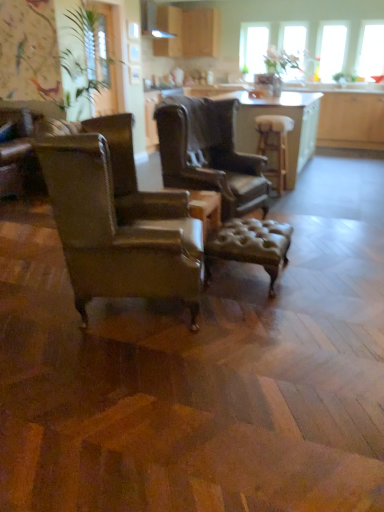
Describe the element at coordinates (293, 46) in the screenshot. I see `transparent glass vase at upper center, positioned as the third window screen in right-to-left order` at that location.

Looking at this image, how much space does transparent glass window at upper right, which is the second window screen in right-to-left order, occupy horizontally?

It is 14.28 centimeters.

The width and height of the screenshot is (384, 512). What are the coordinates of `leather armchair at left, the 2th chair viewed from the back` in the screenshot? It's located at (114, 231).

What is the approximate height of leather armchair at left, the 2th chair viewed from the back?

leather armchair at left, the 2th chair viewed from the back, is 1.06 meters tall.

Image resolution: width=384 pixels, height=512 pixels. What do you see at coordinates (251, 245) in the screenshot? I see `leather tufted stool at center, which is counted as the first stool, starting from the left` at bounding box center [251, 245].

The width and height of the screenshot is (384, 512). I want to click on transparent glass vase at upper center, which is counted as the second window screen, starting from the left, so click(293, 46).

From the image's perspective, is wooden table at center under wooden stool at center, arranged as the 2th stool when ordered from the bottom?

No, from the image's perspective, wooden table at center is not beneath wooden stool at center, arranged as the 2th stool when ordered from the bottom.

Which is more to the right, wooden table at center or wooden stool at center, which is the first stool from back to front?

Positioned to the right is wooden table at center.

Between wooden table at center and wooden stool at center, which ranks as the 1th stool in top-to-bottom order, which one has smaller size?

Smaller between the two is wooden stool at center, which ranks as the 1th stool in top-to-bottom order.

Measure the distance from wooden table at center to wooden stool at center, positioned as the 1th stool in right-to-left order.

wooden table at center is 6.11 inches away from wooden stool at center, positioned as the 1th stool in right-to-left order.

In terms of width, does transparent glass vase at upper center, positioned as the third window screen in right-to-left order, look wider or thinner when compared to transparent glass window at upper right, the first window screen positioned from the right?

Considering their sizes, transparent glass vase at upper center, positioned as the third window screen in right-to-left order, looks broader than transparent glass window at upper right, the first window screen positioned from the right.

From the image's perspective, relative to transparent glass window at upper right, the first window screen positioned from the right, is transparent glass vase at upper center, positioned as the third window screen in right-to-left order, above or below?

transparent glass vase at upper center, positioned as the third window screen in right-to-left order, is situated higher than transparent glass window at upper right, the first window screen positioned from the right, in the image.

Is point (291, 46) closer to camera compared to point (373, 67)?

That is False.

Which object is closer to the camera taking this photo, transparent glass vase at upper center, which is counted as the second window screen, starting from the left, or transparent glass window at upper right, the first window screen positioned from the right?

transparent glass window at upper right, the first window screen positioned from the right, is in front.

Considering the sizes of green leafy plant at upper left and wooden table at center in the image, is green leafy plant at upper left taller or shorter than wooden table at center?

green leafy plant at upper left is taller than wooden table at center.

Consider the image. From the image's perspective, is green leafy plant at upper left on wooden table at center?

Yes, from the image's perspective, green leafy plant at upper left is on top of wooden table at center.

From a real-world perspective, between green leafy plant at upper left and wooden table at center, who is vertically lower?

wooden table at center is physically lower.

Are green leafy plant at upper left and wooden table at center beside each other?

green leafy plant at upper left is not next to wooden table at center, and they're not touching.

Can you confirm if transparent glass window at upper right, which is the third window screen from left to right, is smaller than wooden cabinet at upper center?

Yes, transparent glass window at upper right, which is the third window screen from left to right, is smaller than wooden cabinet at upper center.

Is wooden cabinet at upper center at the back of transparent glass window at upper right, which is the second window screen in right-to-left order?

No, transparent glass window at upper right, which is the second window screen in right-to-left order, is not facing away from wooden cabinet at upper center.

Locate an element on the screen. The height and width of the screenshot is (512, 384). cabinetry above the transparent glass window at upper right, which is the second window screen in right-to-left order (from the image's perspective) is located at coordinates (188, 32).

From the picture: From a real-world perspective, is transparent glass window at upper right, which is the second window screen in right-to-left order, over wooden cabinet at upper center?

No, from a real-world perspective, transparent glass window at upper right, which is the second window screen in right-to-left order, is not over wooden cabinet at upper center

Is clear glass window at upper center, which is the fourth window screen from right to left, positioned with its back to wooden table at center?

That's not correct — clear glass window at upper center, which is the fourth window screen from right to left, is not looking away from wooden table at center.

This screenshot has height=512, width=384. There is a wooden table at center. What are the coordinates of `the 4th window screen above it (from the image's perspective)` in the screenshot? It's located at (253, 48).

How much distance is there between clear glass window at upper center, the 1th window screen when ordered from left to right, and wooden table at center?

A distance of 2.14 meters exists between clear glass window at upper center, the 1th window screen when ordered from left to right, and wooden table at center.

Which is behind, clear glass window at upper center, the 1th window screen when ordered from left to right, or wooden table at center?

Positioned behind is clear glass window at upper center, the 1th window screen when ordered from left to right.

Is leather tufted stool at center, the 2th stool positioned from the top, to the left of transparent glass window at upper right, positioned as the 4th window screen in left-to-right order, from the viewer's perspective?

Indeed, leather tufted stool at center, the 2th stool positioned from the top, is positioned on the left side of transparent glass window at upper right, positioned as the 4th window screen in left-to-right order.

Does leather tufted stool at center, positioned as the first stool in bottom-to-top order, have a greater height compared to transparent glass window at upper right, the first window screen positioned from the right?

No, leather tufted stool at center, positioned as the first stool in bottom-to-top order, is not taller than transparent glass window at upper right, the first window screen positioned from the right.

Does leather tufted stool at center, placed as the 2th stool when sorted from right to left, have a smaller size compared to transparent glass window at upper right, the first window screen positioned from the right?

Incorrect, leather tufted stool at center, placed as the 2th stool when sorted from right to left, is not smaller in size than transparent glass window at upper right, the first window screen positioned from the right.

Is leather tufted stool at center, which is counted as the first stool, starting from the left, beside transparent glass window at upper right, positioned as the 4th window screen in left-to-right order?

No.

Which object is closer to the camera, leather tufted stool at center, the 2th stool positioned from the top, or wooden stool at center, arranged as the 2th stool when viewed from the front?

leather tufted stool at center, the 2th stool positioned from the top, is in front.

The width and height of the screenshot is (384, 512). Identify the location of stool below the wooden stool at center, acting as the 2th stool starting from the left (from the image's perspective). (251, 245).

From a real-world perspective, relative to wooden stool at center, acting as the 2th stool starting from the left, is leather tufted stool at center, which ranks as the first stool in front-to-back order, vertically above or below?

From a real-world perspective, leather tufted stool at center, which ranks as the first stool in front-to-back order, is physically below wooden stool at center, acting as the 2th stool starting from the left.

Are leather tufted stool at center, acting as the 2th stool starting from the back, and wooden stool at center, which ranks as the 1th stool in top-to-bottom order, located far from each other?

Yes, leather tufted stool at center, acting as the 2th stool starting from the back, and wooden stool at center, which ranks as the 1th stool in top-to-bottom order, are located far from each other.

There is a wooden table at center. Where is `the 1st stool below it (from the image's perspective)`? This screenshot has height=512, width=384. the 1st stool below it (from the image's perspective) is located at coordinates (275, 145).

This screenshot has height=512, width=384. Identify the location of the 2nd window screen behind when counting from the transparent glass window at upper right, positioned as the 4th window screen in left-to-right order. (293, 46).

Based on their spatial positions, is transparent glass vase at upper center, which is counted as the second window screen, starting from the left, or wooden table at center further from wooden cabinet at upper center?

wooden table at center is positioned further to the anchor wooden cabinet at upper center.

From the image, which object appears to be nearer to transparent glass window at upper right, positioned as the 4th window screen in left-to-right order, clear glass window at upper center, which is the fourth window screen from right to left, or wooden cabinet at upper center?

clear glass window at upper center, which is the fourth window screen from right to left, lies closer to transparent glass window at upper right, positioned as the 4th window screen in left-to-right order, than the other object.

Estimate the real-world distances between objects in this image. Which object is closer to green leafy plant at upper left, transparent glass window at upper right, the first window screen positioned from the right, or wooden table at center?

wooden table at center is positioned closer to the anchor green leafy plant at upper left.

Which object lies further to the anchor point transparent glass window at upper right, which is the third window screen from left to right, green leafy plant at upper left or transparent glass vase at upper center, positioned as the third window screen in right-to-left order?

Among the two, green leafy plant at upper left is located further to transparent glass window at upper right, which is the third window screen from left to right.

From the image, which object appears to be nearer to clear glass window at upper center, the 1th window screen when ordered from left to right, leather armchair at left, acting as the first chair starting from the front, or wooden table at center?

wooden table at center is closer to clear glass window at upper center, the 1th window screen when ordered from left to right.

Which object lies further to the anchor point leather armchair at center, the 2th chair when ordered from front to back, transparent glass window at upper right, the first window screen positioned from the right, or wooden table at center?

transparent glass window at upper right, the first window screen positioned from the right, is positioned further to the anchor leather armchair at center, the 2th chair when ordered from front to back.

Based on their spatial positions, is wooden cabinet at upper center or wooden table at center further from transparent glass window at upper right, positioned as the 4th window screen in left-to-right order?

Among the two, wooden table at center is located further to transparent glass window at upper right, positioned as the 4th window screen in left-to-right order.

Considering their positions, is wooden stool at center, which is the first stool from back to front, positioned closer to transparent glass vase at upper center, positioned as the third window screen in right-to-left order, than clear glass window at upper center, which is the fourth window screen from right to left?

clear glass window at upper center, which is the fourth window screen from right to left.

This screenshot has width=384, height=512. What are the coordinates of `table between wooden cabinet at upper center and wooden stool at center, arranged as the 2th stool when ordered from the bottom, vertically` in the screenshot? It's located at (282, 115).

The width and height of the screenshot is (384, 512). What are the coordinates of `plant between leather armchair at left, acting as the first chair starting from the front, and transparent glass window at upper right, which is the second window screen in right-to-left order, along the z-axis` in the screenshot? It's located at (83, 56).

Identify the location of cabinetry between wooden stool at center, arranged as the 2th stool when viewed from the front, and clear glass window at upper center, the 1th window screen when ordered from left to right, from front to back. (188, 32).

At what (x,y) coordinates should I click in order to perform the action: click on table located between leather armchair at center, the 2th chair when ordered from front to back, and clear glass window at upper center, which is the fourth window screen from right to left, in the depth direction. Please return your answer as a coordinate pair (x, y). Looking at the image, I should click on (282, 115).